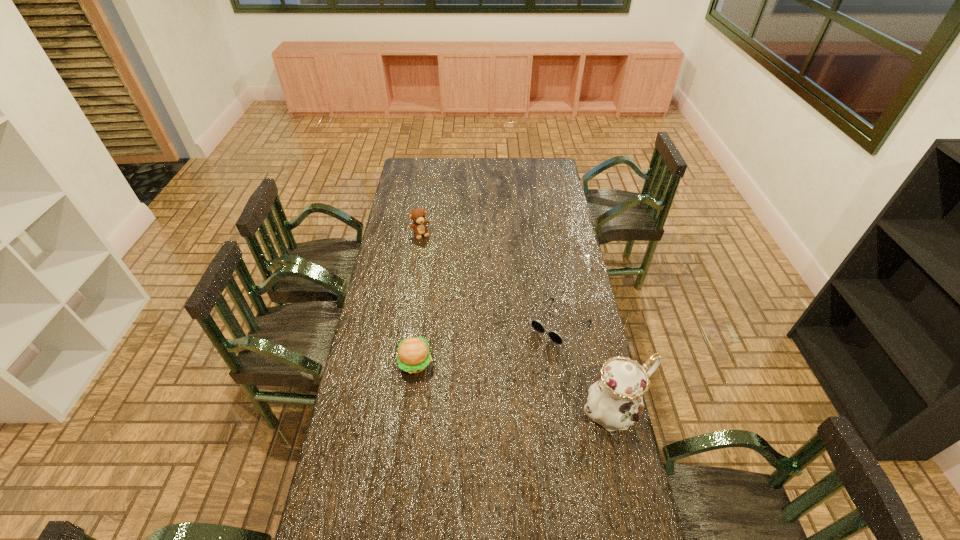
Where is `vacant space at the left edge`? vacant space at the left edge is located at coordinates (356, 367).

Image resolution: width=960 pixels, height=540 pixels. I want to click on vacant space at the right edge, so [539, 190].

Where is `vacant space at the far right corner of the desktop`? Image resolution: width=960 pixels, height=540 pixels. vacant space at the far right corner of the desktop is located at coordinates (557, 163).

Find the location of `free space between the third tallest object and the sunglasses`. free space between the third tallest object and the sunglasses is located at coordinates (488, 343).

Identify the location of free space between the shortest object and the teddy bear. (490, 279).

Image resolution: width=960 pixels, height=540 pixels. I want to click on vacant area that lies between the chinaware and the hamburger, so click(x=515, y=387).

Locate an element on the screen. Image resolution: width=960 pixels, height=540 pixels. free spot between the farthest object and the third tallest object is located at coordinates (418, 298).

This screenshot has width=960, height=540. Find the location of `vacant region between the tallest object and the farthest object`. vacant region between the tallest object and the farthest object is located at coordinates (516, 322).

Find the location of a particular element. The width and height of the screenshot is (960, 540). free space between the chinaware and the third shortest object is located at coordinates (516, 322).

Where is `vacant area that lies between the tallest object and the shortest object`? This screenshot has width=960, height=540. vacant area that lies between the tallest object and the shortest object is located at coordinates (587, 367).